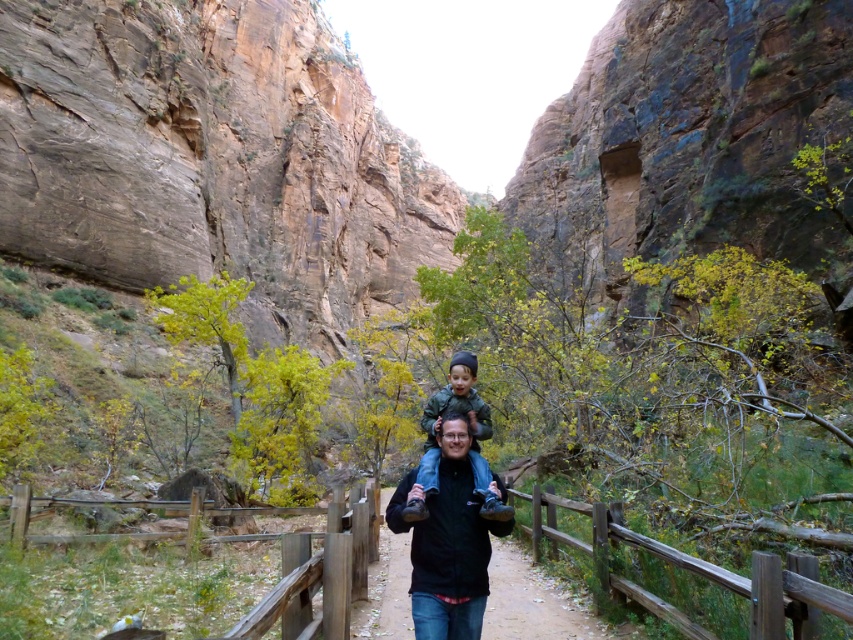
Is point (407, 481) behind point (450, 408)?

No, it is in front of (450, 408).

You are a GUI agent. You are given a task and a screenshot of the screen. Output one action in this format:
    pyautogui.click(x=<x>, y=<y>)
    Task: Click on the black matte jacket at center
    Image resolution: width=853 pixels, height=640 pixels.
    Given the screenshot: What is the action you would take?
    pyautogui.click(x=447, y=541)

From the picture: Between black matte jacket at center and brown wooden trail at center, which one has less height?

brown wooden trail at center

Is black matte jacket at center shorter than brown wooden trail at center?

Incorrect, black matte jacket at center's height does not fall short of brown wooden trail at center's.

Is point (467, 547) in front of point (515, 637)?

Yes, point (467, 547) is closer to viewer.

This screenshot has height=640, width=853. I want to click on black matte jacket at center, so click(447, 541).

Between point (532, 609) and point (488, 500), which one is positioned behind?

The point (532, 609) is more distant.

Image resolution: width=853 pixels, height=640 pixels. I want to click on brown wooden trail at center, so [537, 602].

This screenshot has height=640, width=853. I want to click on brown wooden trail at center, so click(537, 602).

The height and width of the screenshot is (640, 853). I want to click on brown wooden trail at center, so click(537, 602).